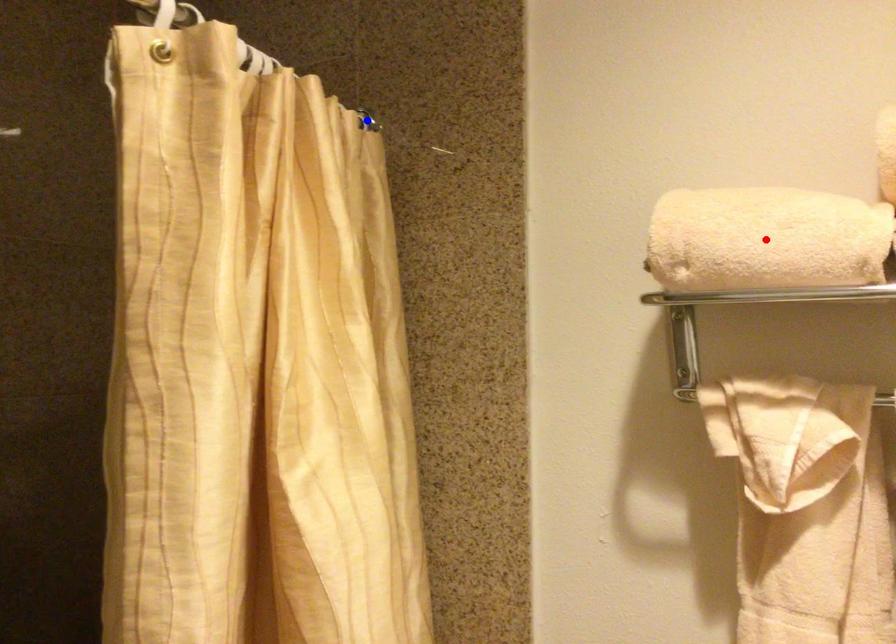
Question: In the image, two points are highlighted. Which point is nearer to the camera? Reply with the corresponding letter.

Choices:
 (A) blue point
 (B) red point

Answer: (B)